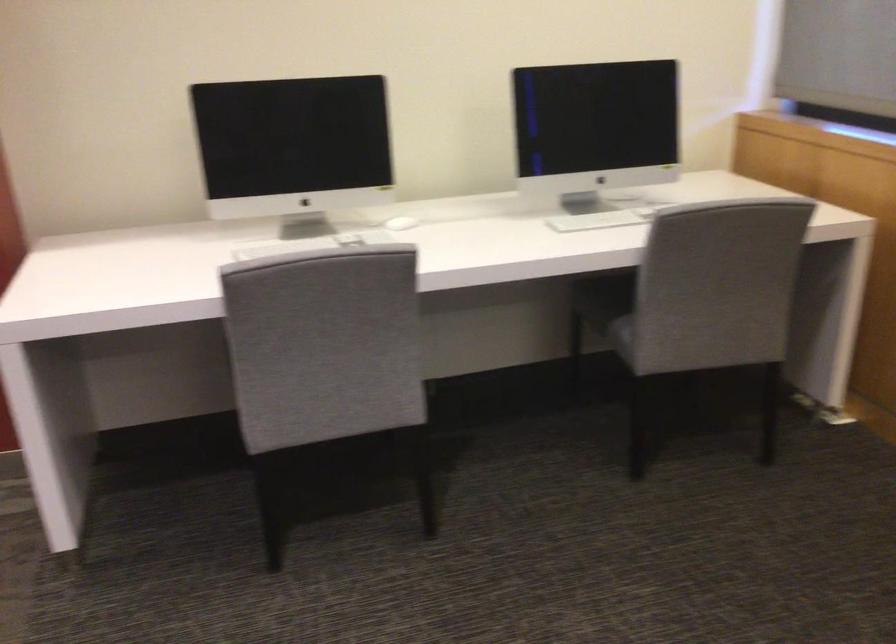
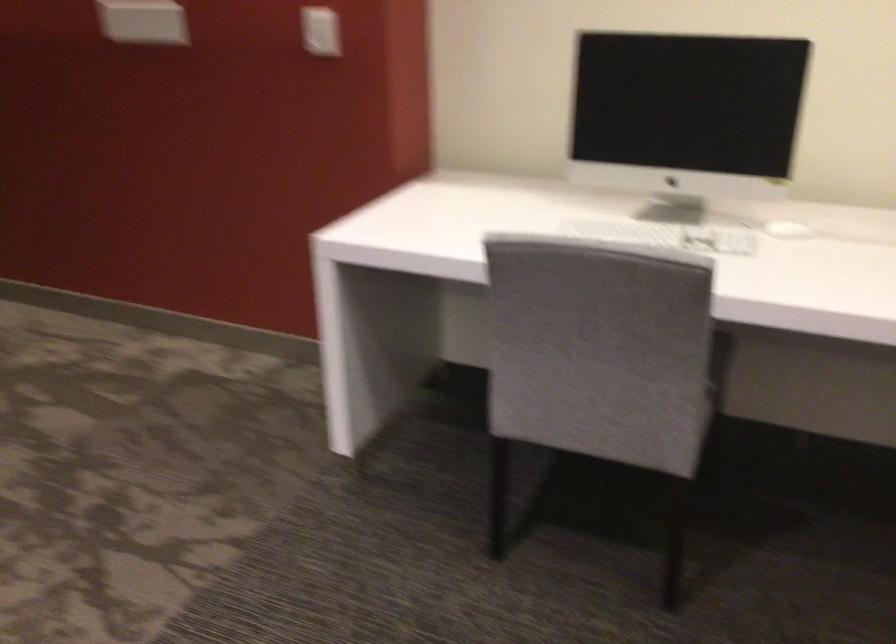
The point at (324, 245) is marked in the first image. Where is the corresponding point in the second image?

(666, 234)